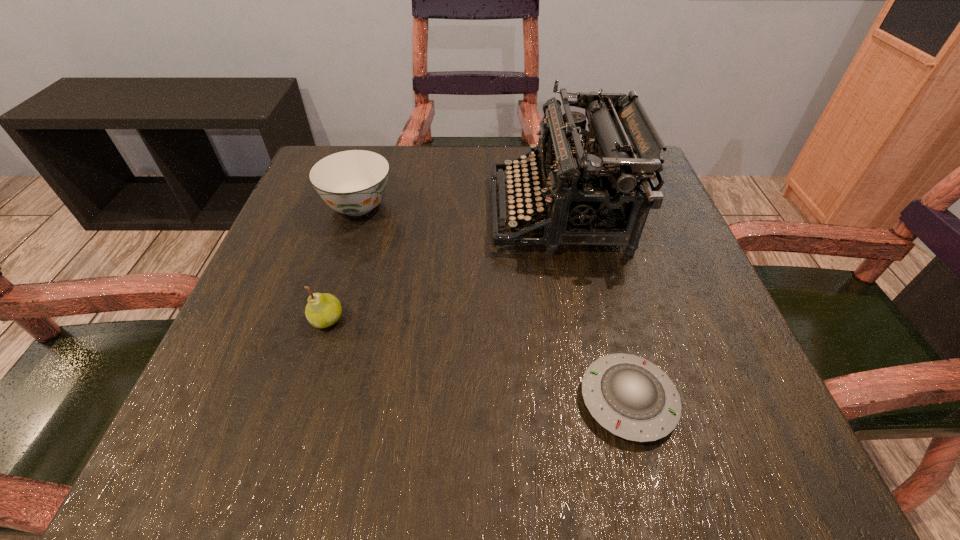
In order to click on vacant region located on the back of the nearest object in this screenshot , I will do `click(598, 283)`.

Image resolution: width=960 pixels, height=540 pixels. I want to click on typewriter at the far edge, so click(x=597, y=188).

Find the location of `soup bowl that is at the far edge`. soup bowl that is at the far edge is located at coordinates (353, 182).

Identify the location of object at the near edge. Image resolution: width=960 pixels, height=540 pixels. (629, 396).

Identify the location of pear that is positioned at the left edge. (322, 310).

Find the location of a particular element. soup bowl that is at the left edge is located at coordinates point(353,182).

Find the location of a particular element. typewriter that is at the right edge is located at coordinates (597, 188).

Find the location of a particular element. The width and height of the screenshot is (960, 540). saucer present at the right edge is located at coordinates (629, 396).

This screenshot has width=960, height=540. I want to click on object at the far left corner, so click(x=353, y=182).

This screenshot has height=540, width=960. Identify the location of object present at the far right corner. (597, 188).